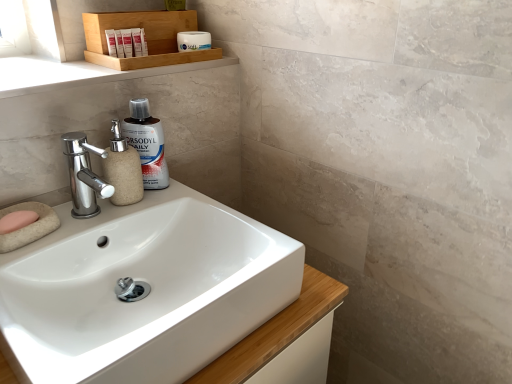
Locate an element on the screen. The height and width of the screenshot is (384, 512). vacant space to the left of white matte tube at upper center, the second toiletry in the left-to-right sequence is located at coordinates (49, 64).